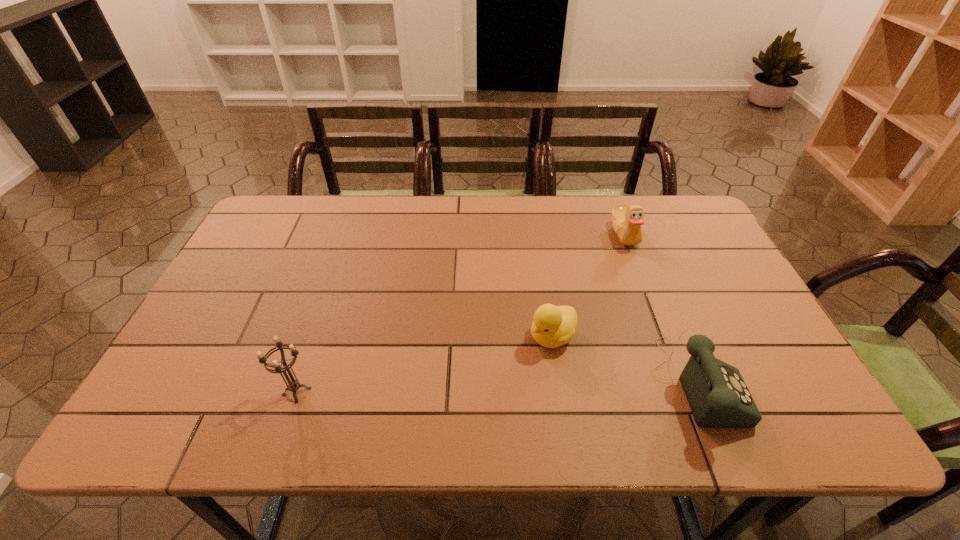
Locate an element on the screen. This screenshot has height=540, width=960. the leftmost object is located at coordinates (293, 386).

Locate an element on the screen. This screenshot has width=960, height=540. candle holder is located at coordinates (293, 386).

The width and height of the screenshot is (960, 540). In order to click on telephone in this screenshot , I will do `click(718, 397)`.

This screenshot has width=960, height=540. In order to click on the farther duck in this screenshot , I will do `click(626, 220)`.

This screenshot has width=960, height=540. Find the location of `the right duck`. the right duck is located at coordinates (626, 220).

The height and width of the screenshot is (540, 960). What are the coordinates of `the nearer duck` in the screenshot? It's located at (553, 326).

Locate an element on the screen. This screenshot has width=960, height=540. the left duck is located at coordinates (553, 326).

The image size is (960, 540). In order to click on vacant space located 0.050m on the right of the tallest object in this screenshot , I will do `click(336, 392)`.

This screenshot has height=540, width=960. I want to click on vacant space situated on the dial of the telephone, so click(762, 384).

Find the location of `free point located at the beak of the right duck`. free point located at the beak of the right duck is located at coordinates (597, 267).